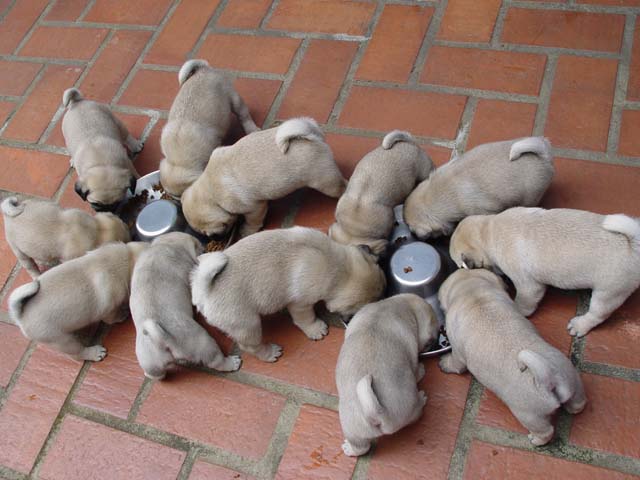
The width and height of the screenshot is (640, 480). Identify the location of brick flooring. (348, 103).